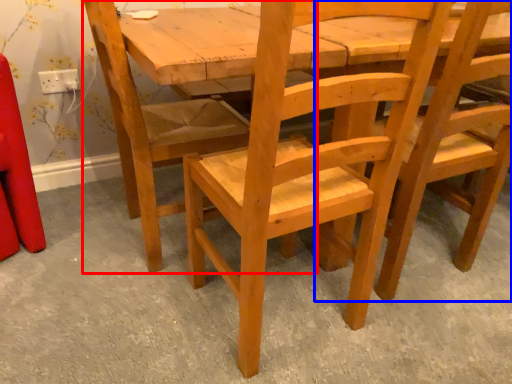
Question: Which object appears closest to the camera in this image, chair (highlighted by a red box) or chair (highlighted by a blue box)?

Choices:
 (A) chair
 (B) chair

Answer: (B)